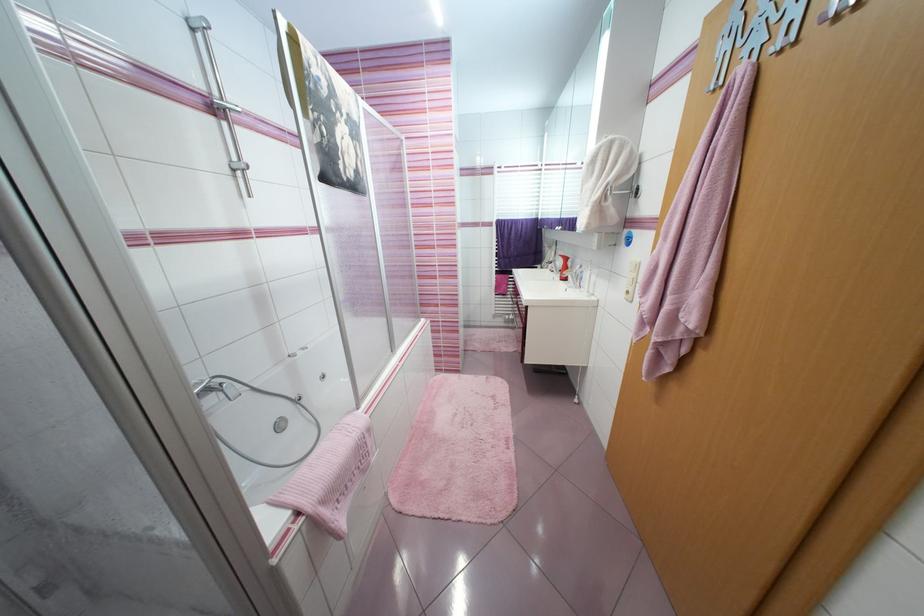
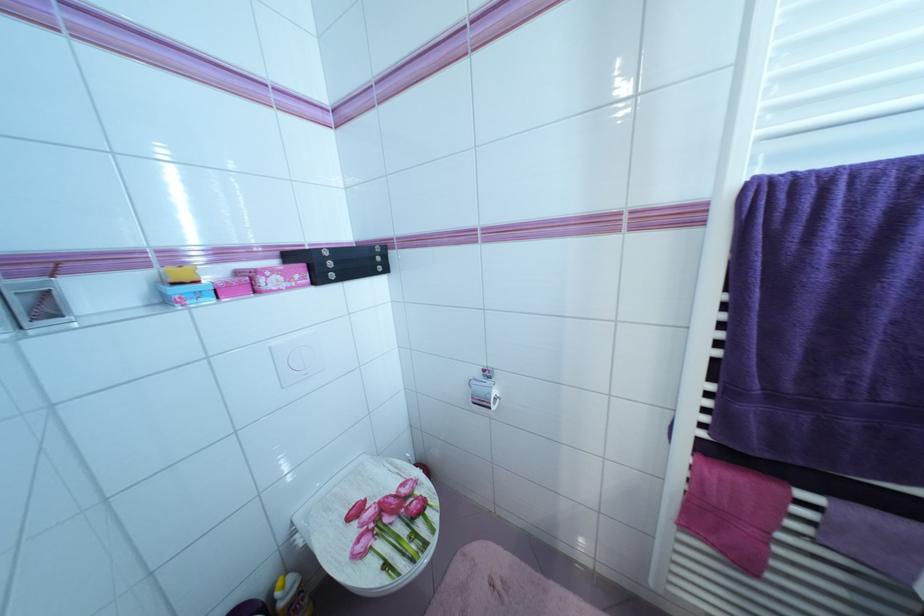
Question: In a continuous first-person perspective shot, in which direction is the camera moving?

Choices:
 (A) Left
 (B) Right
 (C) Forward
 (D) Backward

Answer: (C)